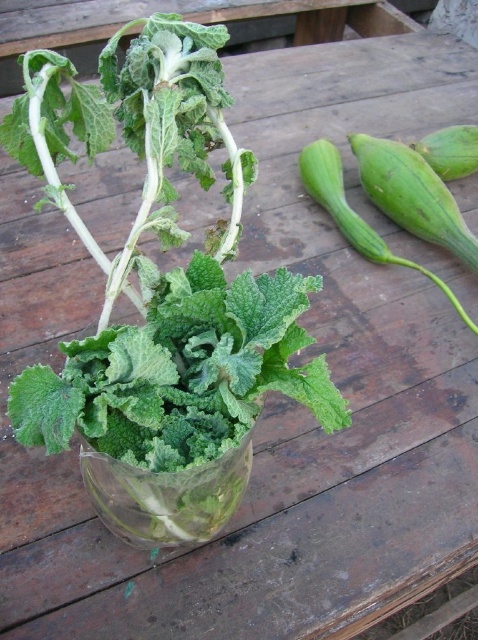
Question: Can you confirm if transparent glass vase at center is wider than green smooth squash at right?

Choices:
 (A) yes
 (B) no

Answer: (B)

Question: Which of the following is the closest to the observer?

Choices:
 (A) (354, 237)
 (B) (159, 536)

Answer: (B)

Question: Which point is farther to the camera?

Choices:
 (A) green smooth squash at right
 (B) transparent glass vase at center

Answer: (A)

Question: Is transparent glass vase at center below green smooth squash at right?

Choices:
 (A) no
 (B) yes

Answer: (B)

Question: Is transparent glass vase at center wider than green smooth squash at right?

Choices:
 (A) yes
 (B) no

Answer: (B)

Question: Which object is farther from the camera taking this photo?

Choices:
 (A) transparent glass vase at center
 (B) green smooth squash at right

Answer: (B)